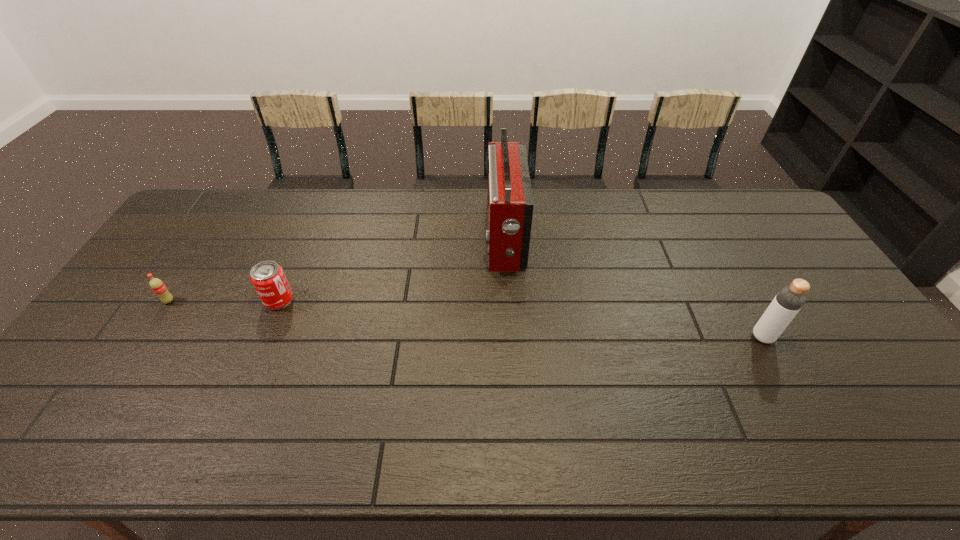
At what (x,y) coordinates should I click in order to perform the action: click on blank space located on the right of the can. Please return your answer as a coordinate pair (x, y). Looking at the image, I should click on (431, 300).

Identify the location of vacant space located 0.050m on the right of the leftmost object. This screenshot has height=540, width=960. (191, 301).

Find the location of a particular element. object that is at the far edge is located at coordinates (510, 202).

Locate an element on the screen. This screenshot has width=960, height=540. object situated at the left edge is located at coordinates (158, 287).

Where is `vacant space at the far edge of the desktop`? Image resolution: width=960 pixels, height=540 pixels. vacant space at the far edge of the desktop is located at coordinates (356, 216).

In order to click on vacant position at the near edge of the desktop in this screenshot , I will do (686, 435).

This screenshot has width=960, height=540. I want to click on vacant space at the left edge of the desktop, so click(x=69, y=396).

This screenshot has width=960, height=540. I want to click on blank space at the far left corner of the desktop, so click(x=214, y=208).

Where is `unoccupied position between the soda and the farthest object`? The height and width of the screenshot is (540, 960). unoccupied position between the soda and the farthest object is located at coordinates (337, 270).

I want to click on free space that is in between the leftmost object and the farthest object, so pos(337,270).